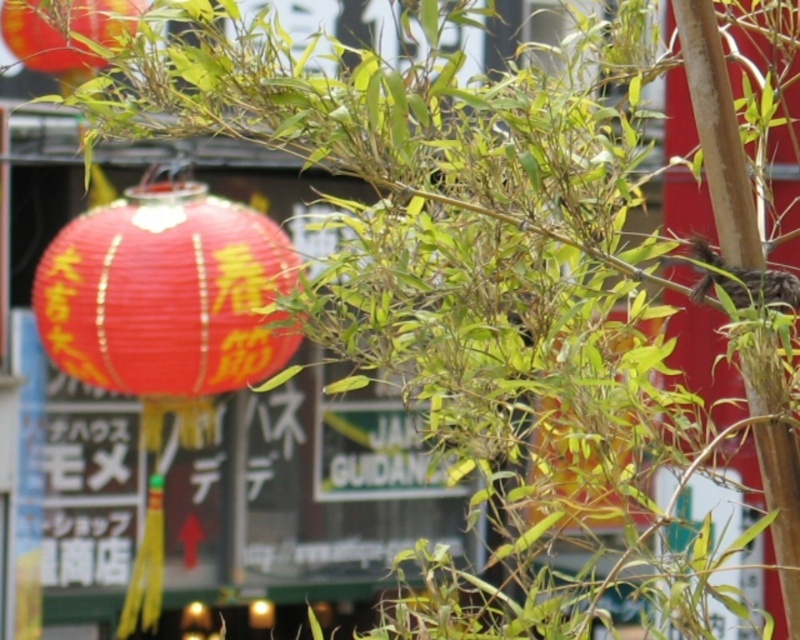
You are an interior designer arranging two matte paper lanterns in a room. The scene shows a matte paper lantern at center and a matte paper lantern at upper left. Which lantern is located to the right of the other?

The matte paper lantern at center is positioned on the right side of the matte paper lantern at upper left, so the lantern at center is to the right of the lantern at upper left.

You are a photographer setting up a shot of the matte paper lantern at center and the bamboo at center. Which object should you focus on first if you want to ensure both are in focus, given that the lantern is closer to the camera?

The matte paper lantern at center is taller than bamboo at center, so focusing on the lantern first would help ensure both are in focus since it is closer and larger.